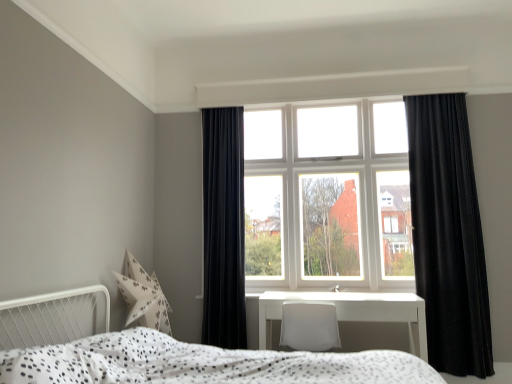
Question: Do you think white dotted fabric bed at lower center is within white glass window at center, or outside of it?

Choices:
 (A) inside
 (B) outside

Answer: (B)

Question: Considering the positions of white dotted fabric bed at lower center and white glass window at center in the image, is white dotted fabric bed at lower center wider or thinner than white glass window at center?

Choices:
 (A) thin
 (B) wide

Answer: (B)

Question: Which object is positioned closest to the white glossy table at center?

Choices:
 (A) white glass window at center
 (B) white dotted fabric bed at lower center
 (C) velvet black curtain at left, the second curtain in the right-to-left sequence
 (D) black velvet curtain at right, the 2th curtain viewed from the left

Answer: (D)

Question: Considering the real-world distances, which object is farthest from the white glass window at center?

Choices:
 (A) black velvet curtain at right, the 2th curtain viewed from the left
 (B) white glossy table at center
 (C) white dotted fabric bed at lower center
 (D) velvet black curtain at left, the first curtain positioned from the left

Answer: (C)